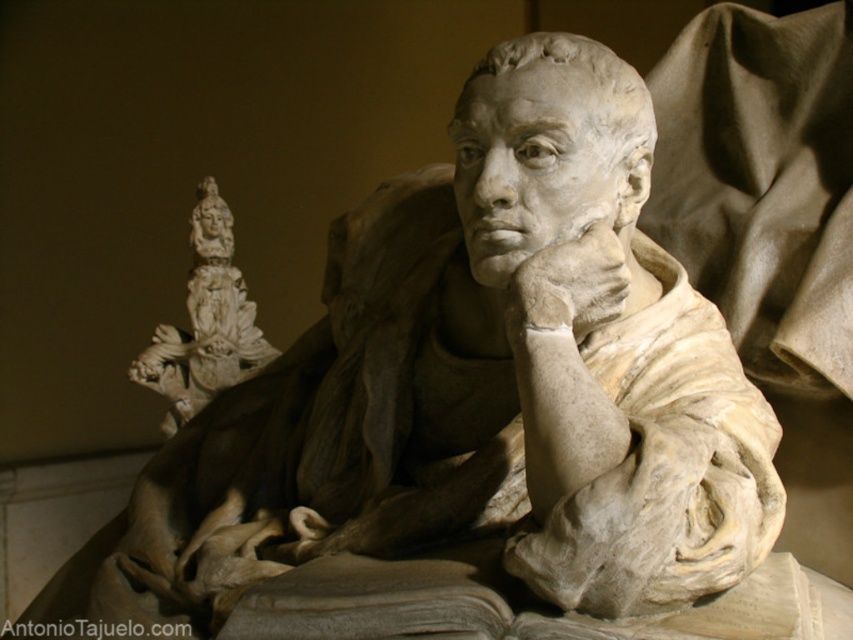
Is white marble statue at upper left further to camera compared to white marble hand at center?

Yes.

Which is in front, point (194, 301) or point (582, 317)?

Point (582, 317)

Where is `white marble statue at upper left`? The image size is (853, 640). white marble statue at upper left is located at coordinates (204, 323).